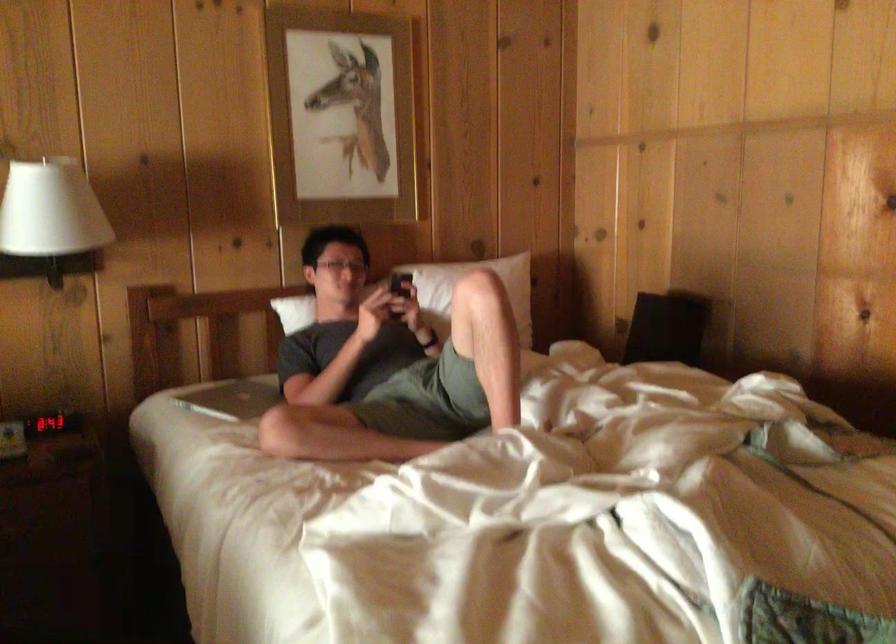
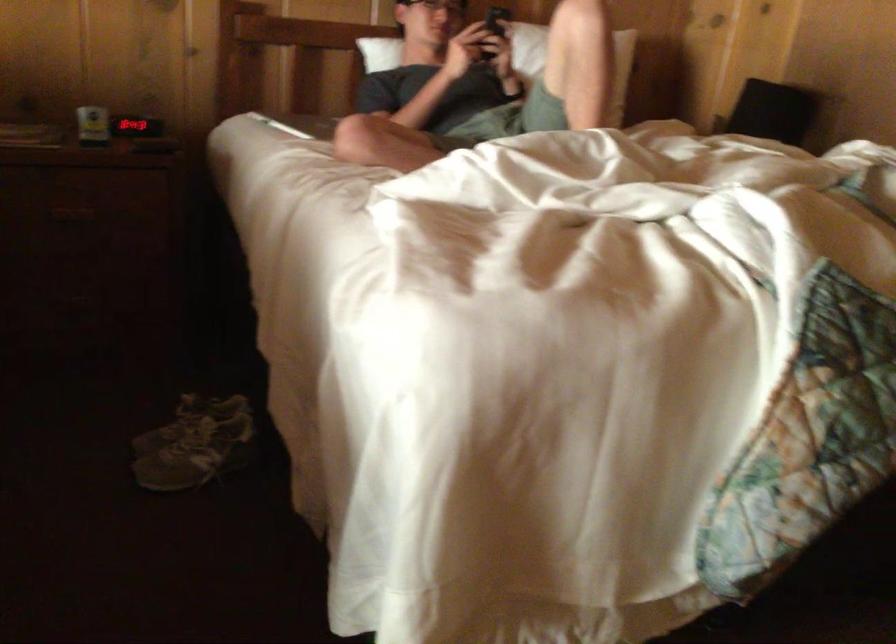
Find the pixel in the second image that matches the point at 398,292 in the first image.

(495, 24)